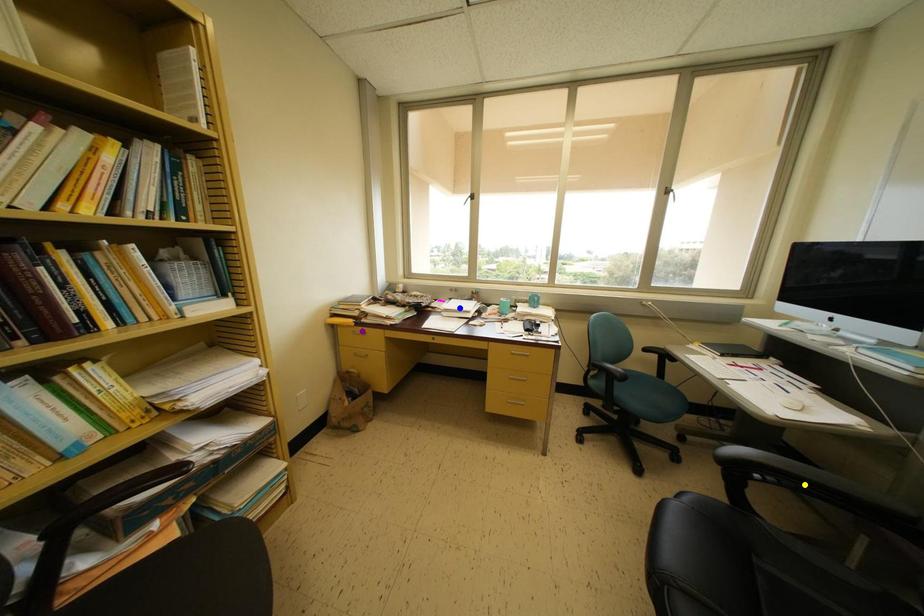
Order these from nearest to farthest:
1. purple point
2. yellow point
3. blue point

yellow point
purple point
blue point